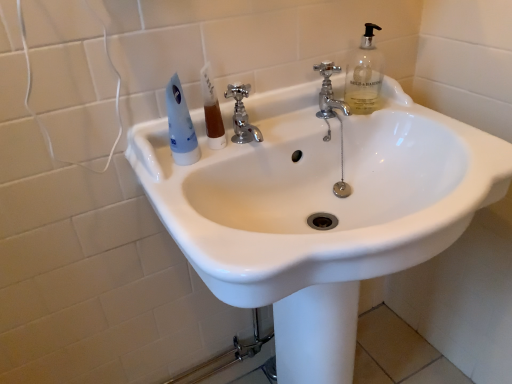
Question: Is the depth of chrome metallic faucet at center, positioned as the second tap in right-to-left order, greater than that of polished chrome faucet at upper center, positioned as the 2th tap in left-to-right order?

Choices:
 (A) yes
 (B) no

Answer: (B)

Question: Does chrome metallic faucet at center, which is counted as the 1th tap, starting from the left, have a larger size compared to polished chrome faucet at upper center, positioned as the 1th tap in right-to-left order?

Choices:
 (A) yes
 (B) no

Answer: (A)

Question: Are chrome metallic faucet at center, positioned as the second tap in right-to-left order, and polished chrome faucet at upper center, positioned as the 2th tap in left-to-right order, located far from each other?

Choices:
 (A) yes
 (B) no

Answer: (B)

Question: Are chrome metallic faucet at center, which is counted as the 1th tap, starting from the left, and polished chrome faucet at upper center, positioned as the 1th tap in right-to-left order, making contact?

Choices:
 (A) no
 (B) yes

Answer: (A)

Question: Would you say polished chrome faucet at upper center, positioned as the 1th tap in right-to-left order, is part of chrome metallic faucet at center, positioned as the second tap in right-to-left order,'s contents?

Choices:
 (A) no
 (B) yes

Answer: (A)

Question: Is polished chrome faucet at upper center, positioned as the 1th tap in right-to-left order, wider or thinner than chrome metallic faucet at center, which is counted as the 1th tap, starting from the left?

Choices:
 (A) thin
 (B) wide

Answer: (B)

Question: Is point (331, 64) closer or farther from the camera than point (240, 102)?

Choices:
 (A) farther
 (B) closer

Answer: (A)

Question: From a real-world perspective, is polished chrome faucet at upper center, positioned as the 1th tap in right-to-left order, positioned above or below chrome metallic faucet at center, which is counted as the 1th tap, starting from the left?

Choices:
 (A) above
 (B) below

Answer: (B)

Question: Is polished chrome faucet at upper center, positioned as the 1th tap in right-to-left order, in front of or behind chrome metallic faucet at center, positioned as the second tap in right-to-left order, in the image?

Choices:
 (A) behind
 (B) front

Answer: (A)

Question: From the image's perspective, is white glossy sink at center above or below chrome metallic faucet at center, positioned as the second tap in right-to-left order?

Choices:
 (A) above
 (B) below

Answer: (B)

Question: Considering their positions, is white glossy sink at center located in front of or behind chrome metallic faucet at center, which is counted as the 1th tap, starting from the left?

Choices:
 (A) behind
 (B) front

Answer: (B)

Question: Considering the positions of point (287, 311) and point (237, 120), is point (287, 311) closer or farther from the camera than point (237, 120)?

Choices:
 (A) closer
 (B) farther

Answer: (B)

Question: Is white glossy sink at center spatially inside chrome metallic faucet at center, which is counted as the 1th tap, starting from the left, or outside of it?

Choices:
 (A) outside
 (B) inside

Answer: (A)

Question: Is brown translucent liquid at center spatially inside white glossy sink at center, or outside of it?

Choices:
 (A) inside
 (B) outside

Answer: (A)

Question: Looking at the image, does brown translucent liquid at center seem bigger or smaller compared to white glossy sink at center?

Choices:
 (A) big
 (B) small

Answer: (B)